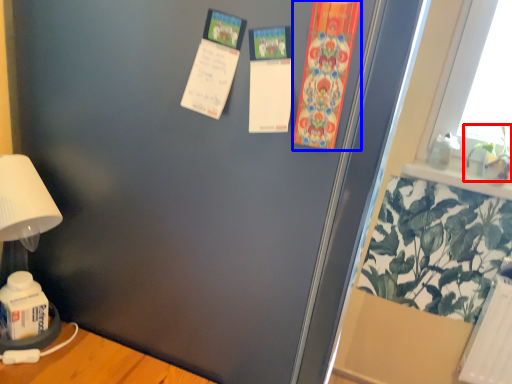
Question: Among these objects, which one is nearest to the camera, plant (highlighted by a red box) or postcard (highlighted by a blue box)?

Choices:
 (A) plant
 (B) postcard

Answer: (B)